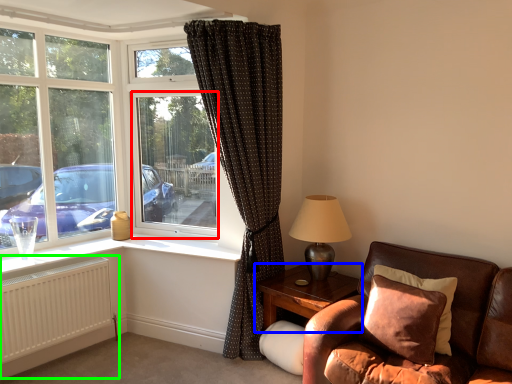
Question: Which object is positioned closest to window screen (highlighted by a red box)? Select from table (highlighted by a blue box) and radiator (highlighted by a green box).

Choices:
 (A) table
 (B) radiator

Answer: (B)